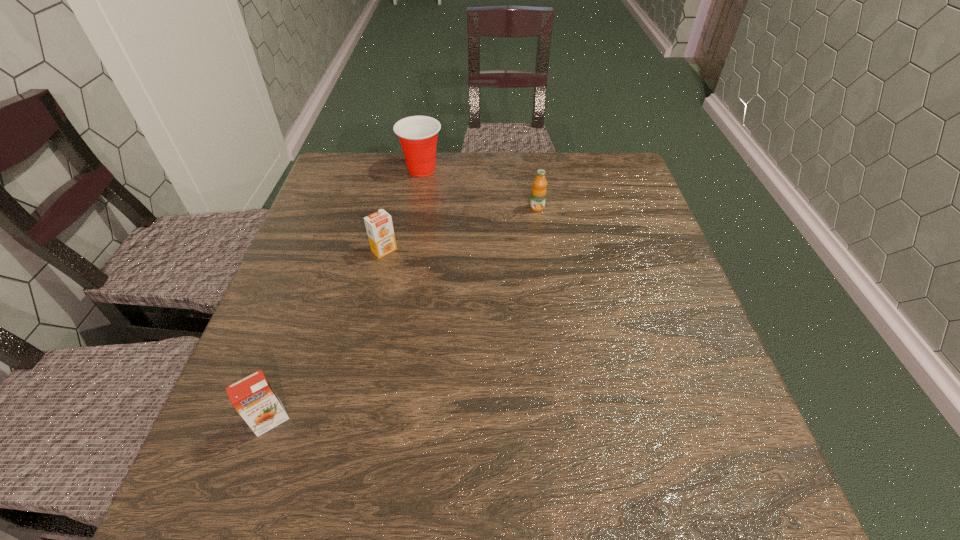
Locate an element on the screen. vacant space at the far right corner of the desktop is located at coordinates (580, 168).

Where is `vacant space that's between the rightmost orange juice and the nearest orange juice`? vacant space that's between the rightmost orange juice and the nearest orange juice is located at coordinates (404, 314).

Locate an element on the screen. The image size is (960, 540). free space between the cup and the second farthest object is located at coordinates (479, 188).

Locate an element on the screen. empty space that is in between the cup and the farthest orange juice is located at coordinates pyautogui.click(x=479, y=188).

This screenshot has width=960, height=540. I want to click on free space that is in between the leftmost orange juice and the rightmost object, so click(x=404, y=314).

Where is `vacant point located between the nearest orange juice and the second farthest object`? vacant point located between the nearest orange juice and the second farthest object is located at coordinates (404, 314).

At what (x,y) coordinates should I click in order to perform the action: click on unoccupied position between the leftmost object and the second nearest orange juice. Please return your answer as a coordinate pair (x, y). This screenshot has height=540, width=960. Looking at the image, I should click on (327, 335).

Find the location of `free space between the nearest orange juice and the third nearest object`. free space between the nearest orange juice and the third nearest object is located at coordinates (404, 314).

Locate an element on the screen. The image size is (960, 540). empty location between the second farthest orange juice and the farthest object is located at coordinates (403, 210).

Find the location of `free area in between the second orange juice from left to right and the tallest object`. free area in between the second orange juice from left to right and the tallest object is located at coordinates (403, 210).